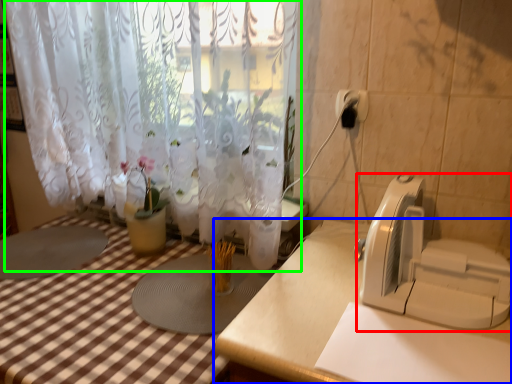
Question: Based on their relative distances, which object is nearer to appliance (highlighted by a red box)? Choose from table (highlighted by a blue box) and curtain (highlighted by a green box).

Choices:
 (A) table
 (B) curtain

Answer: (A)